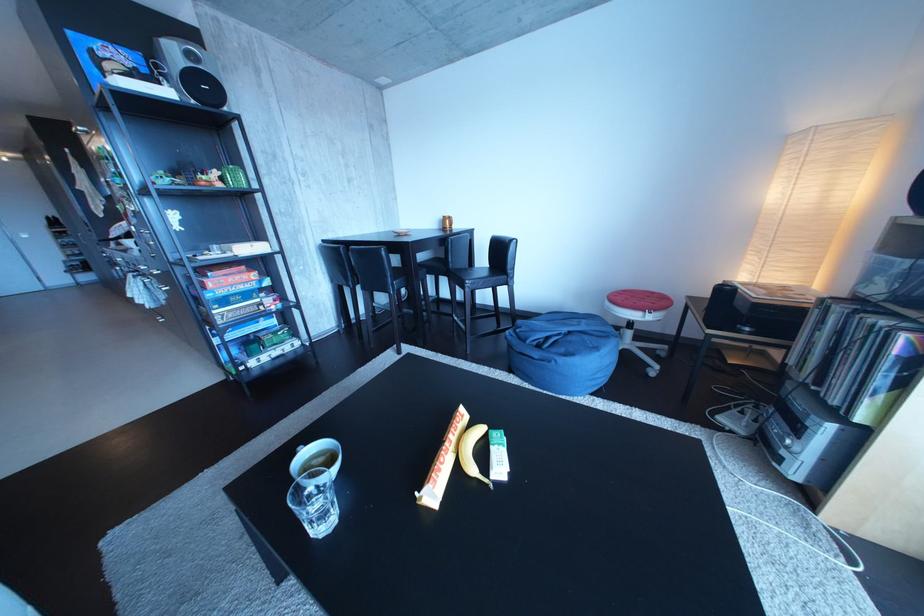
This screenshot has height=616, width=924. Find the location of `red stool seat`. red stool seat is located at coordinates (638, 320).